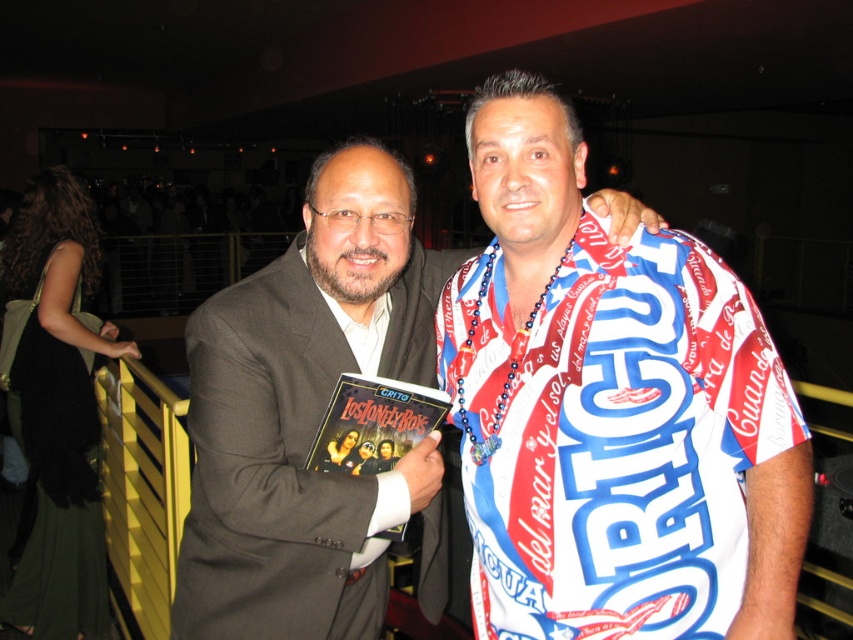
You are a photographer at a social event. You need to position a spotlight on the printed fabric shirt at center and matte black suit at center. Since the spotlight can only illuminate one object at a time, which object should you aim the spotlight at first if you want to follow the left to right rule?

The printed fabric shirt at center is to the right of matte black suit at center. To follow the left to right rule, you should first aim the spotlight at the matte black suit at center before moving to the printed fabric shirt at center.

You are organizing a photo shoot and need to ensure that all items in the frame are visible. Given that the printed fabric shirt at center and the matte plastic book at center are both in the foreground, which item might require more space to fully capture in the photo?

The printed fabric shirt at center is bigger than the matte plastic book at center, so it would require more space to fully capture in the photo.